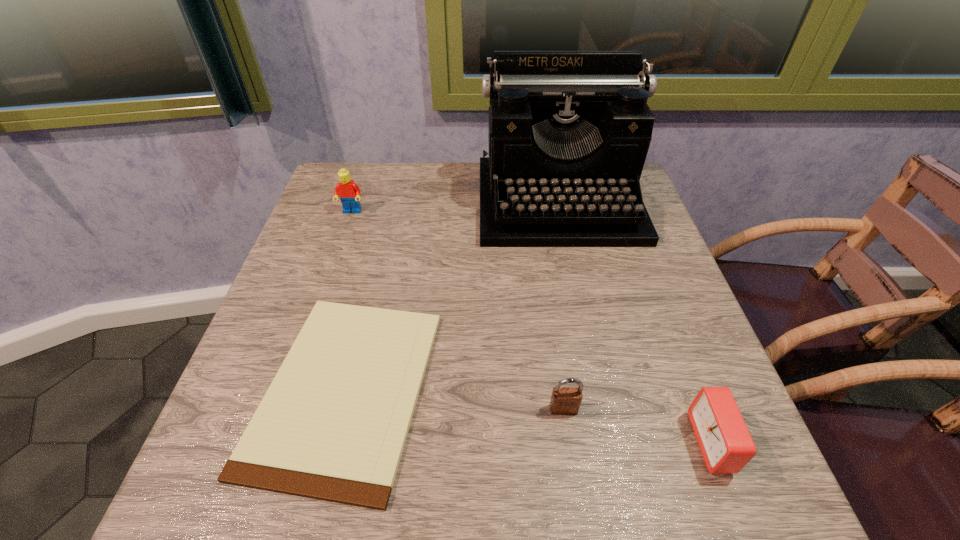
This screenshot has height=540, width=960. I want to click on vacant area that lies between the clipboard and the second tallest object, so click(x=349, y=300).

Image resolution: width=960 pixels, height=540 pixels. I want to click on blank region between the clipboard and the tallest object, so click(452, 295).

In order to click on free space between the clipboard and the padlock in this screenshot , I will do (x=455, y=399).

Locate an element on the screen. The width and height of the screenshot is (960, 540). vacant area that lies between the shortest object and the Lego is located at coordinates [349, 300].

What are the coordinates of `vacant point located between the padlock and the alarm clock` in the screenshot? It's located at (637, 426).

Where is `free space between the alarm clock and the tallest object`? The height and width of the screenshot is (540, 960). free space between the alarm clock and the tallest object is located at coordinates (636, 322).

Image resolution: width=960 pixels, height=540 pixels. I want to click on free space between the clipboard and the tallest object, so click(x=452, y=295).

The image size is (960, 540). Identify the location of vacant space that is in between the Lego and the padlock. (458, 310).

This screenshot has width=960, height=540. In order to click on empty space that is in between the padlock and the typewriter in this screenshot , I will do `click(561, 306)`.

Locate an element on the screen. This screenshot has height=540, width=960. vacant space in between the alarm clock and the typewriter is located at coordinates (636, 322).